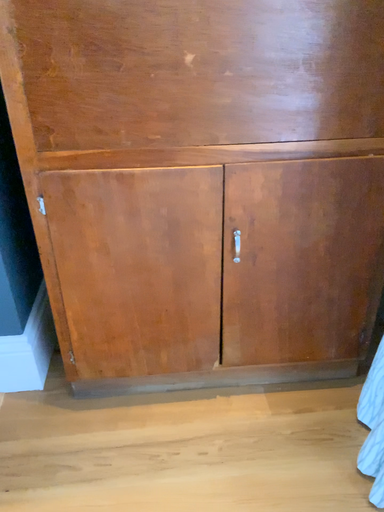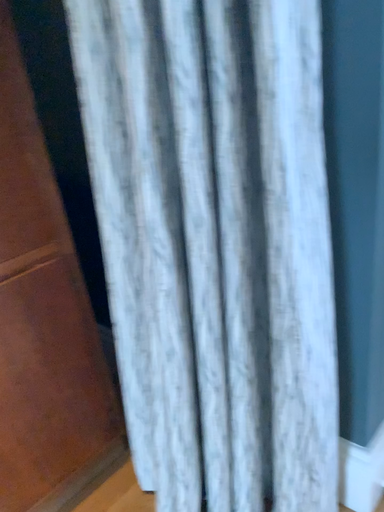
Question: Which way did the camera rotate in the video?

Choices:
 (A) rotated left
 (B) rotated right

Answer: (B)